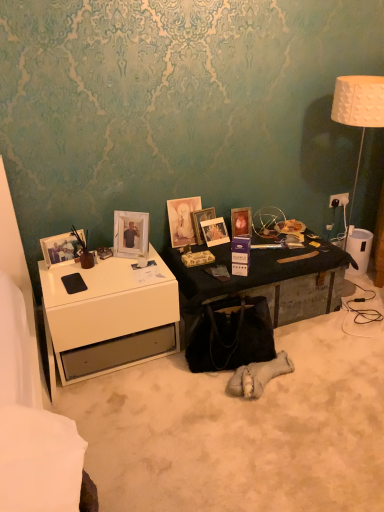
Describe the element at coordinates (231, 335) in the screenshot. I see `black suede handbag at center` at that location.

Measure the distance between white glossy desk at left and camera.

A distance of 6.07 feet exists between white glossy desk at left and camera.

The image size is (384, 512). Describe the element at coordinates (109, 317) in the screenshot. I see `white glossy desk at left` at that location.

Where is `matte wooden picture frame at center, the first picture frame viewed from the right`? The image size is (384, 512). matte wooden picture frame at center, the first picture frame viewed from the right is located at coordinates (241, 221).

The width and height of the screenshot is (384, 512). What do you see at coordinates (182, 220) in the screenshot?
I see `matte glass picture frame at center, which is counted as the fourth picture frame, starting from the right` at bounding box center [182, 220].

Locate an element on the screen. The height and width of the screenshot is (512, 384). matte white picture frame at left, placed as the first picture frame when sorted from left to right is located at coordinates (60, 249).

Measure the distance between point (76, 256) and camera.

Point (76, 256) and camera are 7.18 feet apart.

What do you see at coordinates (266, 281) in the screenshot? I see `metallic black trunk at center` at bounding box center [266, 281].

This screenshot has height=512, width=384. Identify the location of black suede handbag at center. (231, 335).

Is matte white picture frame at left, the sixth picture frame viewed from the right, positioned with its back to white glossy picture frame at upper left, which is the 5th picture frame from right to left?

No, matte white picture frame at left, the sixth picture frame viewed from the right, is not facing away from white glossy picture frame at upper left, which is the 5th picture frame from right to left.

Choose the correct answer: Is matte white picture frame at left, the sixth picture frame viewed from the right, inside white glossy picture frame at upper left, arranged as the second picture frame when viewed from the left, or outside it?

matte white picture frame at left, the sixth picture frame viewed from the right, cannot be found inside white glossy picture frame at upper left, arranged as the second picture frame when viewed from the left.

Does point (53, 258) appear closer or farther from the camera than point (144, 247)?

Point (53, 258) is positioned closer to the camera compared to point (144, 247).

I want to click on the 1st picture frame to the right of the matte white picture frame at left, the sixth picture frame viewed from the right, starting your count from the anchor, so click(x=131, y=234).

From a real-world perspective, who is located lower, matte wooden picture frame at center, the first picture frame viewed from the right, or matte glass picture frame at center, marked as the 3th picture frame in a left-to-right arrangement?

matte wooden picture frame at center, the first picture frame viewed from the right, from a real-world perspective.

Which is in front, point (236, 231) or point (196, 209)?

The point (196, 209) is closer.

Can you tell me how much matte wooden picture frame at center, arranged as the 6th picture frame when viewed from the left, and matte glass picture frame at center, which is counted as the fourth picture frame, starting from the right, differ in facing direction?

The angle between the facing direction of matte wooden picture frame at center, arranged as the 6th picture frame when viewed from the left, and the facing direction of matte glass picture frame at center, which is counted as the fourth picture frame, starting from the right, is 1.27 degrees.

From the image's perspective, is matte wooden picture frame at center, the first picture frame viewed from the right, located above or below matte glass picture frame at center, marked as the 3th picture frame in a left-to-right arrangement?

From the image's perspective, matte wooden picture frame at center, the first picture frame viewed from the right, appears below matte glass picture frame at center, marked as the 3th picture frame in a left-to-right arrangement.

Is there a large distance between matte wooden picture frame at center, which is the third picture frame from right to left, and black suede handbag at center?

They are positioned close to each other.

Consider the image. Is matte wooden picture frame at center, acting as the fourth picture frame starting from the left, spatially inside black suede handbag at center, or outside of it?

matte wooden picture frame at center, acting as the fourth picture frame starting from the left, is spatially situated outside black suede handbag at center.

Which is less distant, (210, 214) or (264, 353)?

Clearly, point (210, 214) is more distant from the camera than point (264, 353).

Does matte wooden picture frame at center, acting as the fourth picture frame starting from the left, have a smaller size compared to black suede handbag at center?

Yes.

Is matte glass picture frame at center, marked as the 3th picture frame in a left-to-right arrangement, completely or partially outside of matte wooden picture frame at center, arranged as the 6th picture frame when viewed from the left?

That's correct, matte glass picture frame at center, marked as the 3th picture frame in a left-to-right arrangement, is outside of matte wooden picture frame at center, arranged as the 6th picture frame when viewed from the left.

Would you say matte glass picture frame at center, which is counted as the fourth picture frame, starting from the right, is a long distance from matte wooden picture frame at center, arranged as the 6th picture frame when viewed from the left?

Actually, matte glass picture frame at center, which is counted as the fourth picture frame, starting from the right, and matte wooden picture frame at center, arranged as the 6th picture frame when viewed from the left, are a little close together.

Where is `picture frame above the matte wooden picture frame at center, arranged as the 6th picture frame when viewed from the left (from the image's perspective)`? The width and height of the screenshot is (384, 512). picture frame above the matte wooden picture frame at center, arranged as the 6th picture frame when viewed from the left (from the image's perspective) is located at coordinates (182, 220).

From a real-world perspective, between matte glass picture frame at center, which is counted as the fourth picture frame, starting from the right, and matte wooden picture frame at center, arranged as the 6th picture frame when viewed from the left, who is vertically higher?

matte glass picture frame at center, which is counted as the fourth picture frame, starting from the right, is physically above.

From a real-world perspective, does matte white picture frame at left, placed as the first picture frame when sorted from left to right, sit lower than black suede handbag at center?

No, from a real-world perspective, matte white picture frame at left, placed as the first picture frame when sorted from left to right, is not under black suede handbag at center.

Considering the relative positions of matte white picture frame at left, placed as the first picture frame when sorted from left to right, and black suede handbag at center in the image provided, is matte white picture frame at left, placed as the first picture frame when sorted from left to right, behind black suede handbag at center?

That is True.

Consider the image. Is matte white picture frame at left, placed as the first picture frame when sorted from left to right, shorter than black suede handbag at center?

Indeed, matte white picture frame at left, placed as the first picture frame when sorted from left to right, has a lesser height compared to black suede handbag at center.

Looking at the image, does matte white picture frame at left, the sixth picture frame viewed from the right, seem bigger or smaller compared to black suede handbag at center?

In the image, matte white picture frame at left, the sixth picture frame viewed from the right, appears to be smaller than black suede handbag at center.

Between matte wooden picture frame at center, arranged as the 6th picture frame when viewed from the left, and wooden photo frame at center, the 2th picture frame positioned from the right, which one appears on the right side from the viewer's perspective?

Positioned to the right is matte wooden picture frame at center, arranged as the 6th picture frame when viewed from the left.

From a real-world perspective, starting from the wooden photo frame at center, the fifth picture frame positioned from the left, which picture frame is the 1st one vertically above it? Please provide its 2D coordinates.

[(241, 221)]

Between matte wooden picture frame at center, the first picture frame viewed from the right, and wooden photo frame at center, the 2th picture frame positioned from the right, which one has smaller size?

wooden photo frame at center, the 2th picture frame positioned from the right.

Is white glossy desk at left facing towards white glossy picture frame at upper left, which is the 5th picture frame from right to left?

No, white glossy desk at left is not aimed at white glossy picture frame at upper left, which is the 5th picture frame from right to left.

From the image's perspective, relative to white glossy picture frame at upper left, arranged as the second picture frame when viewed from the left, is white glossy desk at left above or below?

Based on their image positions, white glossy desk at left is located beneath white glossy picture frame at upper left, arranged as the second picture frame when viewed from the left.

Between white glossy desk at left and white glossy picture frame at upper left, which is the 5th picture frame from right to left, which one has smaller width?

white glossy picture frame at upper left, which is the 5th picture frame from right to left, is thinner.

Which picture frame is the 1st one when counting from the right side of the matte white picture frame at left, placed as the first picture frame when sorted from left to right? Please provide its 2D coordinates.

[(131, 234)]

The width and height of the screenshot is (384, 512). What are the coordinates of `the 1st picture frame below the matte glass picture frame at center, which is counted as the fourth picture frame, starting from the right (from the image's perspective)` in the screenshot? It's located at pos(241,221).

Looking at the image, which one is located closer to wooden photo frame at center, the fifth picture frame positioned from the left, matte wooden picture frame at center, which is the third picture frame from right to left, or black suede handbag at center?

The object closer to wooden photo frame at center, the fifth picture frame positioned from the left, is matte wooden picture frame at center, which is the third picture frame from right to left.

When comparing their distances from matte glass picture frame at center, which is counted as the fourth picture frame, starting from the right, does white glossy picture frame at upper left, which is the 5th picture frame from right to left, or wooden photo frame at center, the fifth picture frame positioned from the left, seem closer?

Among the two, wooden photo frame at center, the fifth picture frame positioned from the left, is located nearer to matte glass picture frame at center, which is counted as the fourth picture frame, starting from the right.

When comparing their distances from matte wooden picture frame at center, which is the third picture frame from right to left, does matte glass picture frame at center, marked as the 3th picture frame in a left-to-right arrangement, or wooden photo frame at center, the fifth picture frame positioned from the left, seem further?

matte glass picture frame at center, marked as the 3th picture frame in a left-to-right arrangement, is further to matte wooden picture frame at center, which is the third picture frame from right to left.

Based on their spatial positions, is metallic black trunk at center or white glossy picture frame at upper left, which is the 5th picture frame from right to left, further from matte glass picture frame at center, marked as the 3th picture frame in a left-to-right arrangement?

metallic black trunk at center is positioned further to the anchor matte glass picture frame at center, marked as the 3th picture frame in a left-to-right arrangement.

Considering their positions, is black suede handbag at center positioned further to white glossy desk at left than matte wooden picture frame at center, the first picture frame viewed from the right?

Among the two, matte wooden picture frame at center, the first picture frame viewed from the right, is located further to white glossy desk at left.

Based on their spatial positions, is matte wooden picture frame at center, which is the third picture frame from right to left, or black suede handbag at center closer to white glossy desk at left?

black suede handbag at center is positioned closer to the anchor white glossy desk at left.

Estimate the real-world distances between objects in this image. Which object is further from matte glass picture frame at center, marked as the 3th picture frame in a left-to-right arrangement, wooden photo frame at center, the fifth picture frame positioned from the left, or matte wooden picture frame at center, which is the third picture frame from right to left?

wooden photo frame at center, the fifth picture frame positioned from the left, lies further to matte glass picture frame at center, marked as the 3th picture frame in a left-to-right arrangement, than the other object.

When comparing their distances from matte white picture frame at left, the sixth picture frame viewed from the right, does white glossy desk at left or matte wooden picture frame at center, the first picture frame viewed from the right, seem closer?

Based on the image, white glossy desk at left appears to be nearer to matte white picture frame at left, the sixth picture frame viewed from the right.

What are the coordinates of `handbag between white glossy desk at left and metallic black trunk at center from left to right` in the screenshot? It's located at (231, 335).

Find the location of `table between matte glass picture frame at center, which is counted as the fourth picture frame, starting from the right, and white plastic power outlet at upper right from left to right`. table between matte glass picture frame at center, which is counted as the fourth picture frame, starting from the right, and white plastic power outlet at upper right from left to right is located at coordinates (266, 281).

The image size is (384, 512). In order to click on picture frame between white glossy picture frame at upper left, arranged as the second picture frame when viewed from the left, and matte wooden picture frame at center, acting as the fourth picture frame starting from the left, in the horizontal direction in this screenshot , I will do `click(182, 220)`.

Identify the location of desk between matte glass picture frame at center, marked as the 3th picture frame in a left-to-right arrangement, and black suede handbag at center, in the vertical direction. (109, 317).